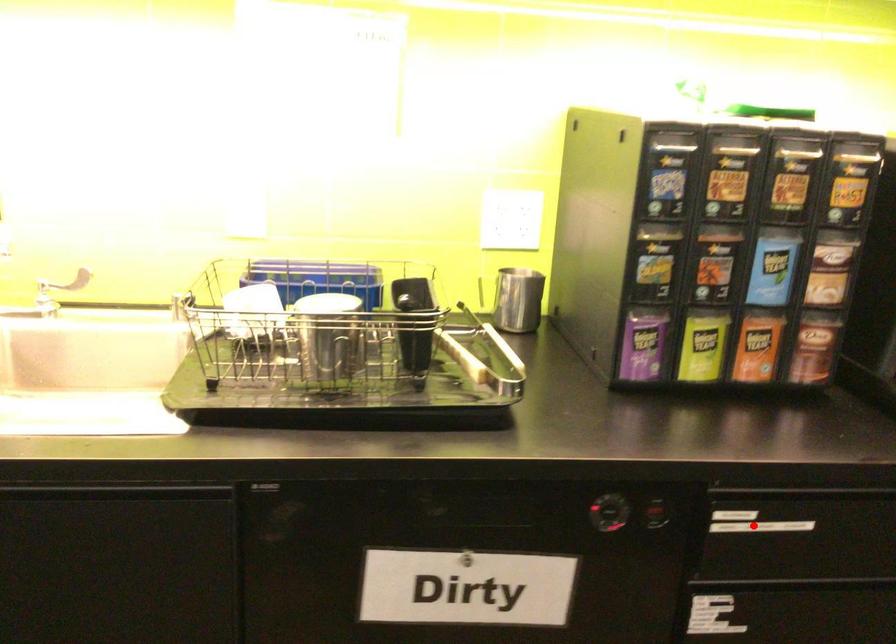
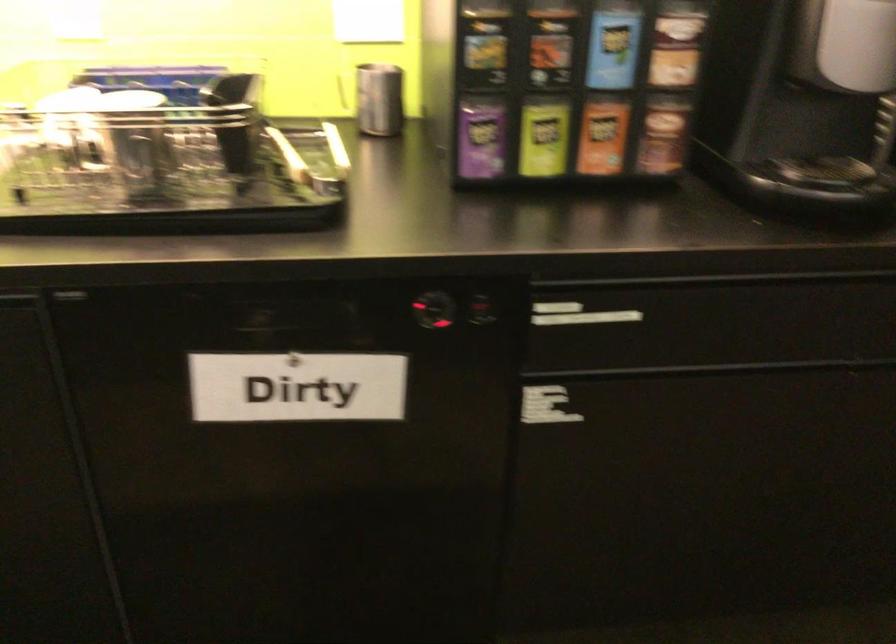
Question: I am providing you with two images of the same scene from different viewpoints. A red point is marked on the first image. Can you still see the location of the red point in image 2?

Choices:
 (A) Yes
 (B) No

Answer: (A)